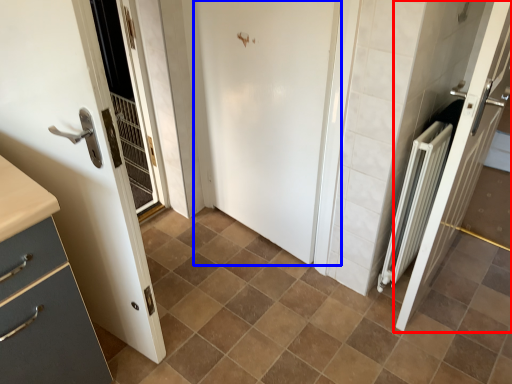
Question: Among these objects, which one is farthest to the camera, door (highlighted by a red box) or door (highlighted by a blue box)?

Choices:
 (A) door
 (B) door

Answer: (B)